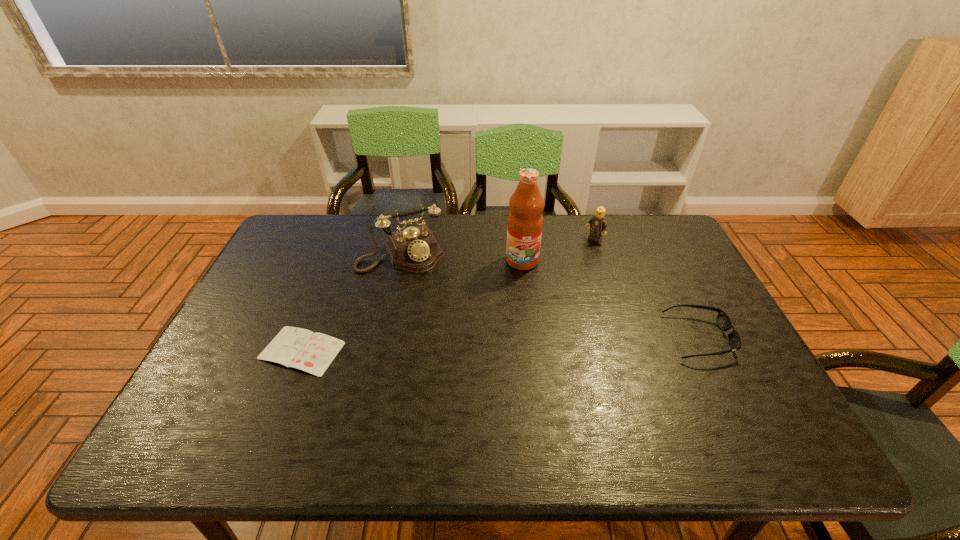
Locate an element on the screen. The height and width of the screenshot is (540, 960). the closest object to the Lego is located at coordinates (525, 222).

Locate an element on the screen. This screenshot has height=540, width=960. free location that satisfies the following two spatial constraints: 1. on the back side of the fourth shortest object; 2. on the right side of the shortest object is located at coordinates (340, 253).

The height and width of the screenshot is (540, 960). I want to click on vacant point that satisfies the following two spatial constraints: 1. on the front side of the sunglasses; 2. on the front-facing side of the fruit juice, so click(531, 338).

Where is `free space that satisfies the following two spatial constraints: 1. on the back side of the third tallest object; 2. on the left side of the diary`? This screenshot has width=960, height=540. free space that satisfies the following two spatial constraints: 1. on the back side of the third tallest object; 2. on the left side of the diary is located at coordinates (345, 240).

Where is `vacant space that satisfies the following two spatial constraints: 1. on the back side of the shortest object; 2. on the front-facing side of the rightmost object`? The image size is (960, 540). vacant space that satisfies the following two spatial constraints: 1. on the back side of the shortest object; 2. on the front-facing side of the rightmost object is located at coordinates (307, 338).